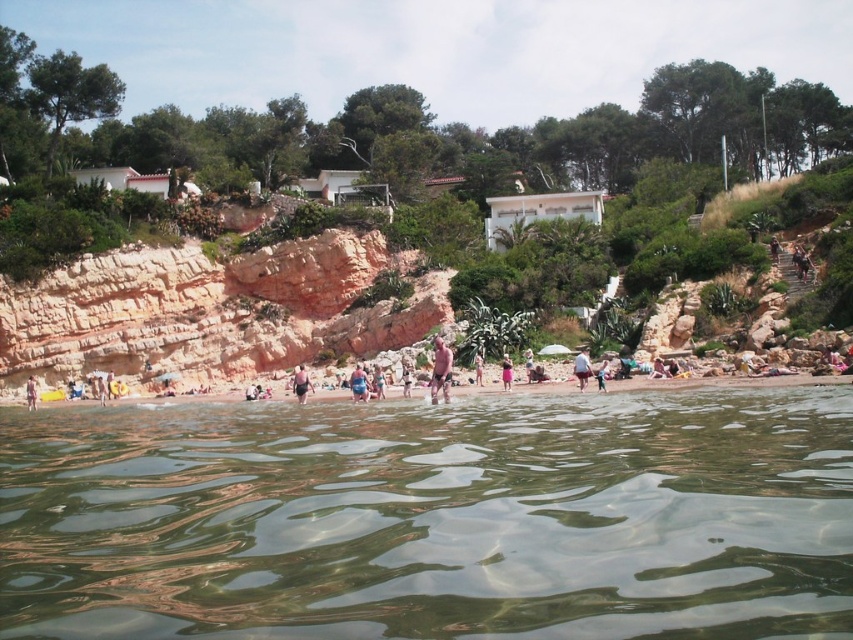
Consider the image. You are a photographer trying to capture a closeup of the smooth tan skin at center. Your camera has a focal length of 50mm and you are currently standing at a distance of 2 meters away. To achieve the ideal closeup, you need the subject to fill the frame, which requires the subject to occupy 80 percent of the image height. Given the subject is at point 0.600, 0.354 in the image, will you need to move closer or farther away?

The smooth tan skin at center is located at point [300,384]. To fill 80 percent of the image height, you would need to move closer to the subject.